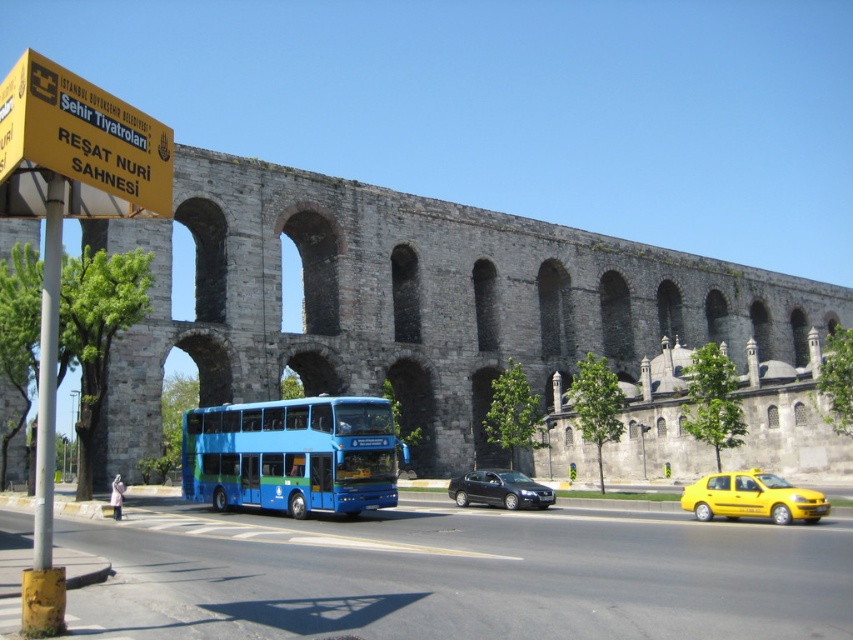
Question: Which object appears farthest from the camera in this image?

Choices:
 (A) shiny black sedan at center
 (B) yellow plastic sign at upper left
 (C) blue metallic bus at center
 (D) yellow matte taxi at lower right

Answer: (A)

Question: Does yellow matte taxi at lower right appear on the left side of shiny black sedan at center?

Choices:
 (A) no
 (B) yes

Answer: (A)

Question: Does yellow matte taxi at lower right appear on the right side of shiny black sedan at center?

Choices:
 (A) no
 (B) yes

Answer: (B)

Question: Estimate the real-world distances between objects in this image. Which object is closer to the blue metallic bus at center?

Choices:
 (A) yellow plastic sign at upper left
 (B) shiny black sedan at center

Answer: (B)

Question: Can you confirm if yellow plastic sign at upper left is thinner than yellow matte taxi at lower right?

Choices:
 (A) yes
 (B) no

Answer: (A)

Question: Considering the real-world distances, which object is closest to the shiny black sedan at center?

Choices:
 (A) blue metallic bus at center
 (B) yellow plastic sign at upper left

Answer: (A)